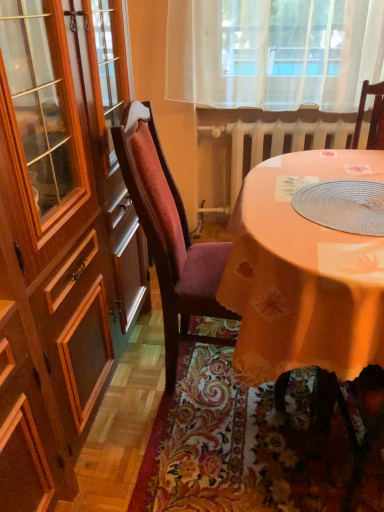
Identify the location of vacant space behind clear plastic placemat at center. This screenshot has width=384, height=512. (325, 166).